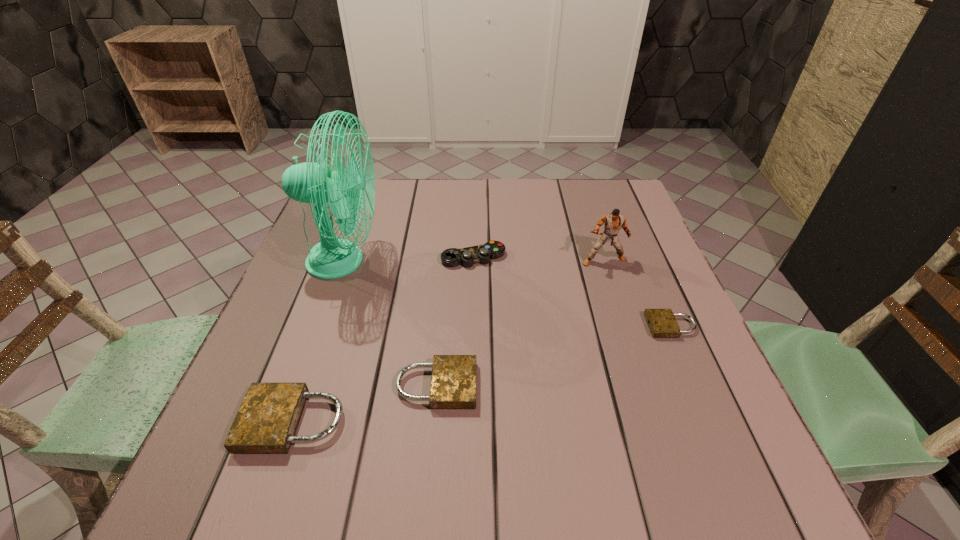
Where is `vacant space that's between the second padlock from right to left and the leftmost padlock`? The image size is (960, 540). vacant space that's between the second padlock from right to left and the leftmost padlock is located at coordinates (366, 404).

The image size is (960, 540). I want to click on vacant area between the tallest object and the rightmost padlock, so click(x=508, y=294).

Find the location of a particular element. empty space between the fourth farthest object and the leftmost padlock is located at coordinates (483, 374).

Where is `free spot between the puncher and the rightmost padlock`? free spot between the puncher and the rightmost padlock is located at coordinates (637, 293).

Where is `object that is the fourth closest to the second shortest padlock`? The height and width of the screenshot is (540, 960). object that is the fourth closest to the second shortest padlock is located at coordinates (662, 323).

Select which object is the fourth closest to the control. Please provide its 2D coordinates. Your answer should be formatted as a tuple, i.e. [(x, y)], where the tuple contains the x and y coordinates of a point satisfying the conditions above.

[(662, 323)]

At what (x,y) coordinates should I click in order to perform the action: click on padlock object that ranks as the closest to the leftmost padlock. Please return your answer as a coordinate pair (x, y). The height and width of the screenshot is (540, 960). Looking at the image, I should click on (453, 383).

Where is `padlock that is the closest one to the fan`? padlock that is the closest one to the fan is located at coordinates (453, 383).

Locate an element on the screen. The image size is (960, 540). vacant region that satisfies the following two spatial constraints: 1. on the front-facing side of the second tallest object; 2. on the keyhole side of the second padlock from right to left is located at coordinates (644, 386).

Find the location of a particular element. free space that satisfies the following two spatial constraints: 1. on the front-facing side of the puncher; 2. in front of the tallest object to blow air is located at coordinates (604, 261).